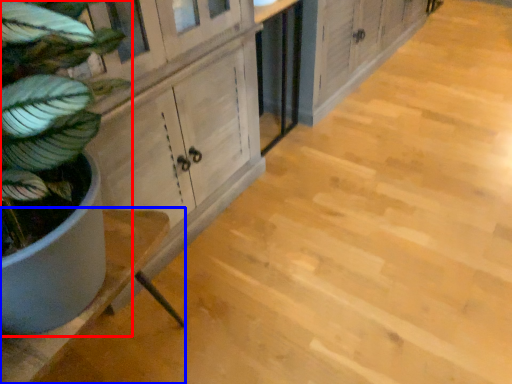
Question: Which of the following is the closest to the observer, houseplant (highlighted by a red box) or counter (highlighted by a blue box)?

Choices:
 (A) houseplant
 (B) counter

Answer: (A)